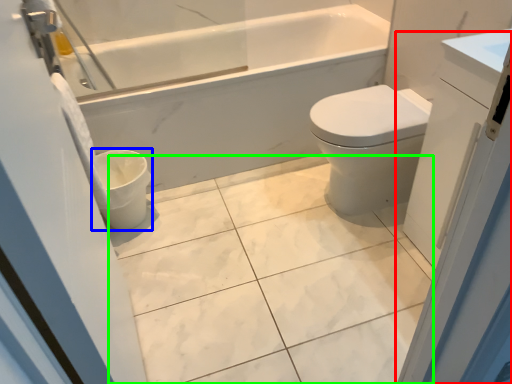
Question: Estimate the real-world distances between objects in this image. Which object is farther from screen door (highlighted by a red box), toilet bowl (highlighted by a blue box) or ceramic tile (highlighted by a green box)?

Choices:
 (A) toilet bowl
 (B) ceramic tile

Answer: (A)